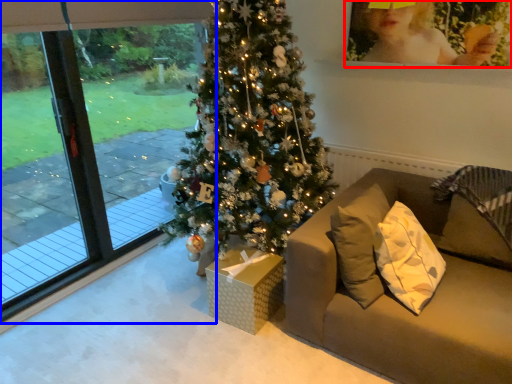
Question: Which of the following is the farthest to the observer, picture frame (highlighted by a red box) or window (highlighted by a blue box)?

Choices:
 (A) picture frame
 (B) window

Answer: (A)